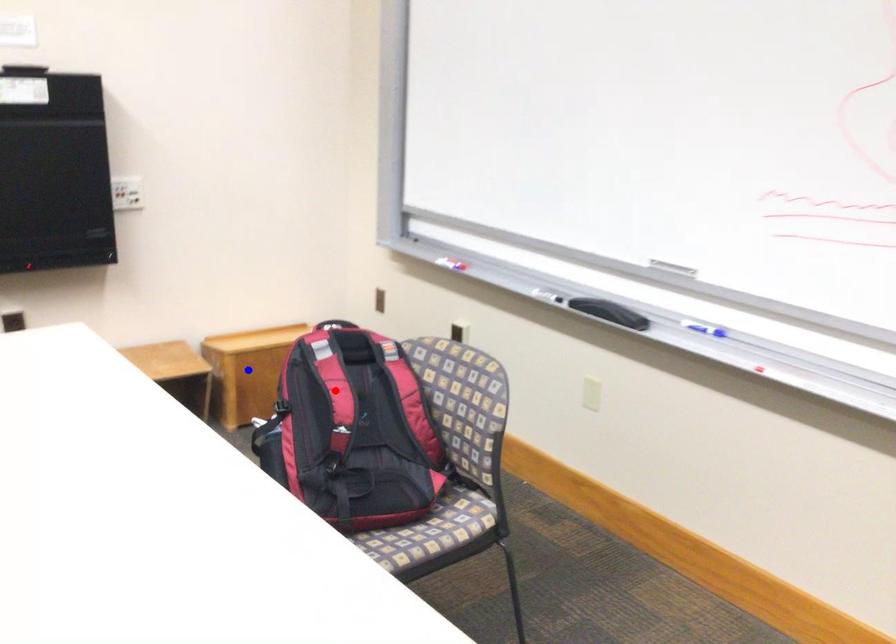
Question: Two points are marked on the image. Which point is closer to the camera?

Choices:
 (A) Blue point is closer.
 (B) Red point is closer.

Answer: (B)